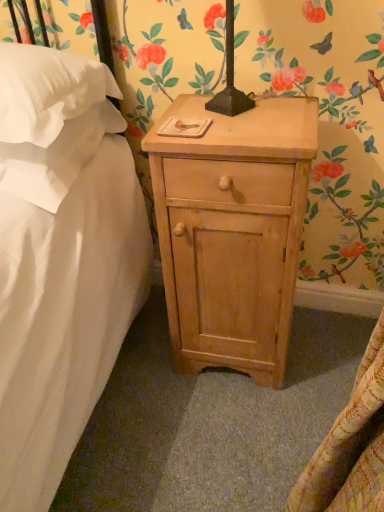
Identify the location of empty space that is to the right of natural wood nightstand at center. (323, 351).